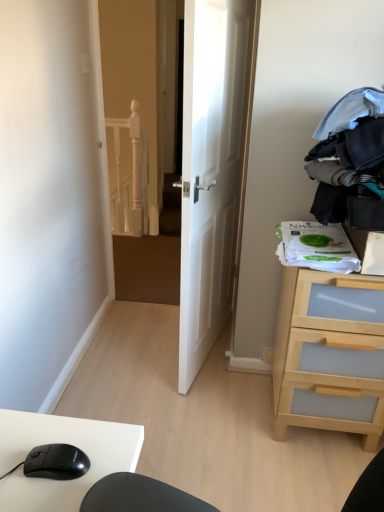
Identify the location of vacant space in white glossy door at center (from a real-world perspective). The image size is (384, 512). (213, 353).